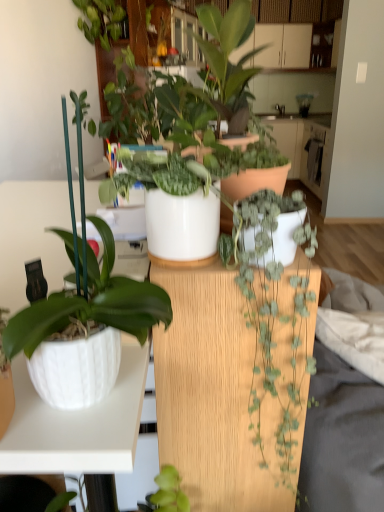
Question: Is matte white pot at center, which appears as the fourth houseplant when ordered from the bottom, positioned behind white glossy countertop at center?

Choices:
 (A) no
 (B) yes

Answer: (A)

Question: From a real-world perspective, is matte white pot at center, acting as the 1th houseplant starting from the top, located beneath white glossy countertop at center?

Choices:
 (A) yes
 (B) no

Answer: (B)

Question: From the image's perspective, would you say matte white pot at center, acting as the 1th houseplant starting from the top, is shown under white glossy countertop at center?

Choices:
 (A) no
 (B) yes

Answer: (B)

Question: Does matte white pot at center, which appears as the fourth houseplant when ordered from the bottom, have a lesser width compared to white glossy countertop at center?

Choices:
 (A) no
 (B) yes

Answer: (B)

Question: From the image's perspective, is matte white pot at center, acting as the 1th houseplant starting from the top, over white glossy countertop at center?

Choices:
 (A) yes
 (B) no

Answer: (B)

Question: Is point (261, 115) positioned closer to the camera than point (168, 201)?

Choices:
 (A) closer
 (B) farther

Answer: (B)

Question: From the image's perspective, relative to white glossy pot at center, placed as the third houseplant when sorted from bottom to top, is white glossy countertop at center above or below?

Choices:
 (A) above
 (B) below

Answer: (A)

Question: Based on their sizes in the image, would you say white glossy countertop at center is bigger or smaller than white glossy pot at center, placed as the third houseplant when sorted from bottom to top?

Choices:
 (A) big
 (B) small

Answer: (A)

Question: Considering the positions of white glossy countertop at center and white glossy pot at center, the 2th houseplant when ordered from top to bottom, in the image, is white glossy countertop at center wider or thinner than white glossy pot at center, the 2th houseplant when ordered from top to bottom,?

Choices:
 (A) wide
 (B) thin

Answer: (A)

Question: Do you think white glossy pot at center, the 2th houseplant when ordered from top to bottom, is within green matte plant at center, arranged as the 1th houseplant when ordered from the bottom, or outside of it?

Choices:
 (A) inside
 (B) outside

Answer: (B)

Question: Is white glossy pot at center, placed as the third houseplant when sorted from bottom to top, to the left or to the right of green matte plant at center, arranged as the 1th houseplant when ordered from the bottom, in the image?

Choices:
 (A) left
 (B) right

Answer: (A)

Question: Considering the positions of white glossy pot at center, the 2th houseplant when ordered from top to bottom, and green matte plant at center, arranged as the 1th houseplant when ordered from the bottom, in the image, is white glossy pot at center, the 2th houseplant when ordered from top to bottom, taller or shorter than green matte plant at center, arranged as the 1th houseplant when ordered from the bottom,?

Choices:
 (A) tall
 (B) short

Answer: (B)

Question: Does point (213, 214) appear closer or farther from the camera than point (256, 228)?

Choices:
 (A) closer
 (B) farther

Answer: (B)

Question: In the image, is white glossy pot at center, the 2th houseplant when ordered from top to bottom, on the left side or the right side of white glossy countertop at center?

Choices:
 (A) right
 (B) left

Answer: (B)

Question: From a real-world perspective, is white glossy pot at center, the 2th houseplant when ordered from top to bottom, above or below white glossy countertop at center?

Choices:
 (A) above
 (B) below

Answer: (A)